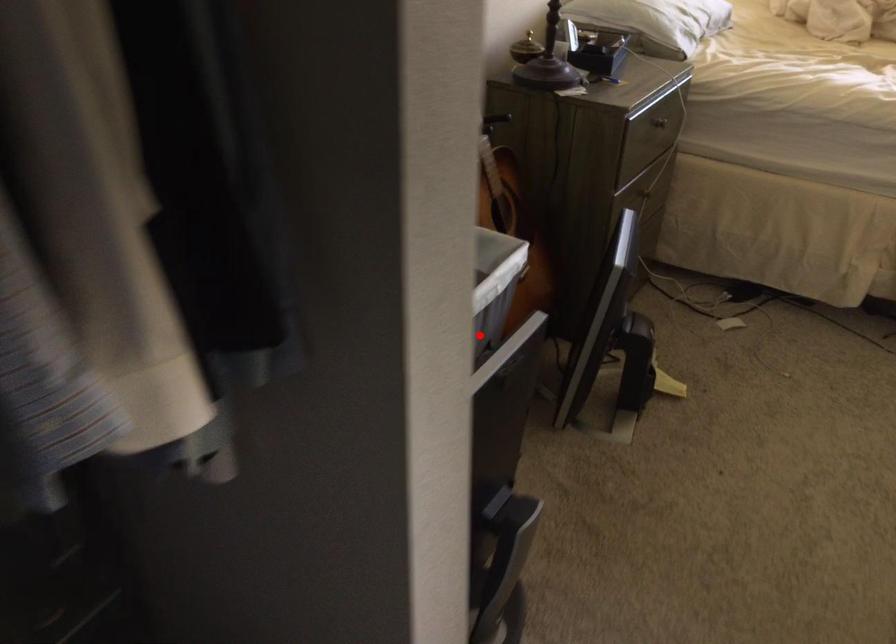
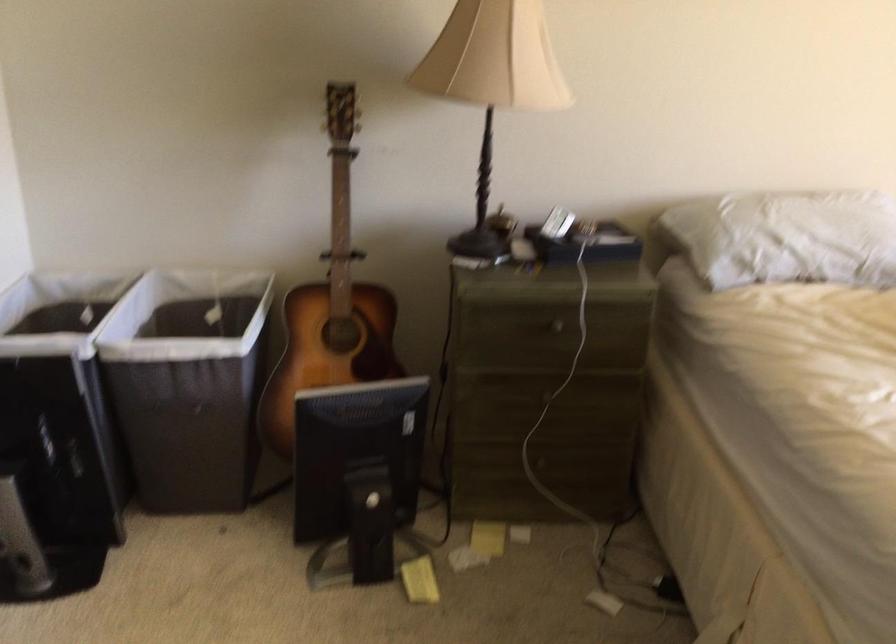
Where in the second image is the point corresponding to the highlighted location from the first image?

(188, 384)